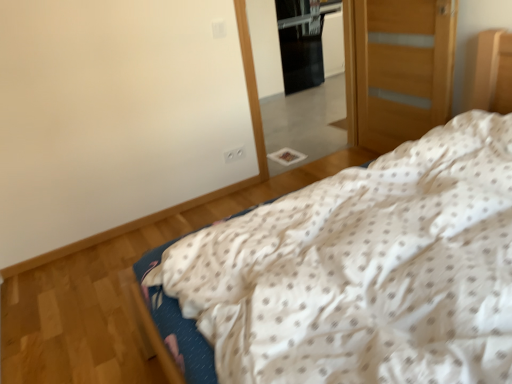
Question: From a real-world perspective, is clear glass mirror at center on black glass screen door at upper center?

Choices:
 (A) yes
 (B) no

Answer: (A)

Question: Is clear glass mirror at center closer to the viewer compared to black glass screen door at upper center?

Choices:
 (A) yes
 (B) no

Answer: (A)

Question: Does clear glass mirror at center have a larger size compared to black glass screen door at upper center?

Choices:
 (A) yes
 (B) no

Answer: (B)

Question: Is clear glass mirror at center oriented away from black glass screen door at upper center?

Choices:
 (A) no
 (B) yes

Answer: (A)

Question: Is clear glass mirror at center taller than black glass screen door at upper center?

Choices:
 (A) no
 (B) yes

Answer: (B)

Question: Is clear glass mirror at center directly adjacent to black glass screen door at upper center?

Choices:
 (A) no
 (B) yes

Answer: (A)

Question: Can you confirm if wooden door at right is shorter than black glass screen door at upper center?

Choices:
 (A) no
 (B) yes

Answer: (B)

Question: Considering the relative sizes of wooden door at right and black glass screen door at upper center in the image provided, is wooden door at right taller than black glass screen door at upper center?

Choices:
 (A) no
 (B) yes

Answer: (A)

Question: Is wooden door at right oriented away from black glass screen door at upper center?

Choices:
 (A) no
 (B) yes

Answer: (A)

Question: Does wooden door at right have a larger size compared to black glass screen door at upper center?

Choices:
 (A) no
 (B) yes

Answer: (A)

Question: From the image's perspective, is wooden door at right on black glass screen door at upper center?

Choices:
 (A) yes
 (B) no

Answer: (B)

Question: Is wooden door at right at the right side of black glass screen door at upper center?

Choices:
 (A) no
 (B) yes

Answer: (B)

Question: From the image's perspective, would you say black glass screen door at upper center is shown under white dotted fabric at center?

Choices:
 (A) no
 (B) yes

Answer: (A)